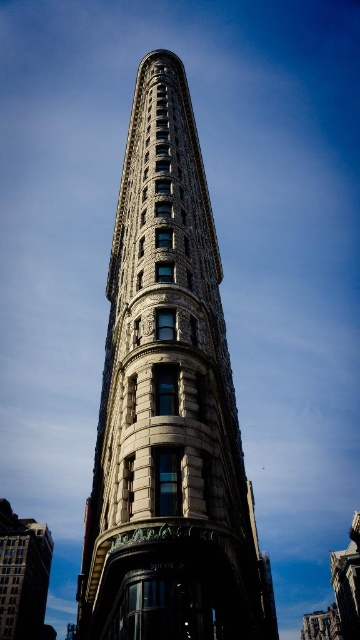
Is stone textured building at center above white stone building at lower left?

Indeed, stone textured building at center is positioned over white stone building at lower left.

Between point (158, 60) and point (6, 522), which one is positioned behind?

Positioned behind is point (6, 522).

Identify the location of stone textured building at center. (168, 406).